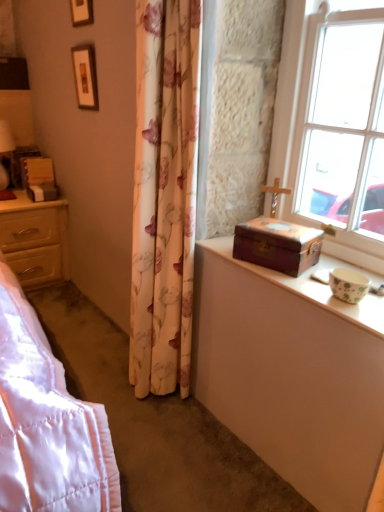
Question: Is matte white table lamp at left outside of floral fabric curtain at center?

Choices:
 (A) no
 (B) yes

Answer: (B)

Question: Considering the relative sizes of matte white table lamp at left and floral fabric curtain at center in the image provided, is matte white table lamp at left thinner than floral fabric curtain at center?

Choices:
 (A) no
 (B) yes

Answer: (A)

Question: Is matte white table lamp at left facing towards floral fabric curtain at center?

Choices:
 (A) no
 (B) yes

Answer: (B)

Question: Does matte white table lamp at left appear on the left side of floral fabric curtain at center?

Choices:
 (A) no
 (B) yes

Answer: (B)

Question: From a real-world perspective, is matte white table lamp at left on floral fabric curtain at center?

Choices:
 (A) no
 (B) yes

Answer: (B)

Question: In the image, is clear glass window at upper right positioned in front of or behind matte white table lamp at left?

Choices:
 (A) front
 (B) behind

Answer: (A)

Question: Considering the positions of point [286, 170] and point [1, 137], is point [286, 170] closer or farther from the camera than point [1, 137]?

Choices:
 (A) closer
 (B) farther

Answer: (A)

Question: From a real-world perspective, is clear glass window at upper right physically located above or below matte white table lamp at left?

Choices:
 (A) below
 (B) above

Answer: (B)

Question: From their relative heights in the image, would you say clear glass window at upper right is taller or shorter than matte white table lamp at left?

Choices:
 (A) short
 (B) tall

Answer: (B)

Question: Considering the positions of floral fabric curtain at center and matte white table lamp at left in the image, is floral fabric curtain at center bigger or smaller than matte white table lamp at left?

Choices:
 (A) big
 (B) small

Answer: (A)

Question: From the image's perspective, is floral fabric curtain at center located above or below matte white table lamp at left?

Choices:
 (A) above
 (B) below

Answer: (B)

Question: Considering the relative positions of floral fabric curtain at center and matte white table lamp at left in the image provided, is floral fabric curtain at center to the left or to the right of matte white table lamp at left?

Choices:
 (A) left
 (B) right

Answer: (B)

Question: Considering the positions of floral fabric curtain at center and matte white table lamp at left in the image, is floral fabric curtain at center wider or thinner than matte white table lamp at left?

Choices:
 (A) thin
 (B) wide

Answer: (A)

Question: Choose the correct answer: Is wooden picture frame at upper left, which is the 1th picture frame from bottom to top, inside wooden chest at right or outside it?

Choices:
 (A) inside
 (B) outside

Answer: (B)

Question: Is point (76, 62) positioned closer to the camera than point (326, 267)?

Choices:
 (A) closer
 (B) farther

Answer: (B)